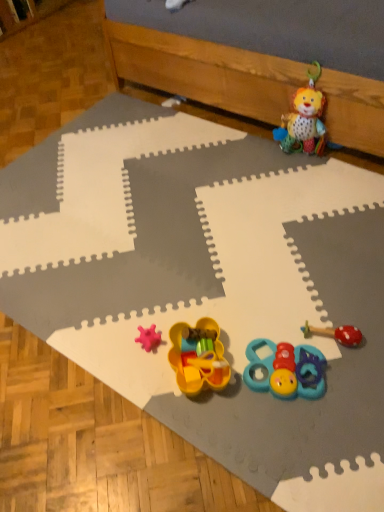
The width and height of the screenshot is (384, 512). Find the location of `vacant area in front of red rubber teething ring at lower right, which is the 2th toy in back-to-front order`. vacant area in front of red rubber teething ring at lower right, which is the 2th toy in back-to-front order is located at coordinates (347, 396).